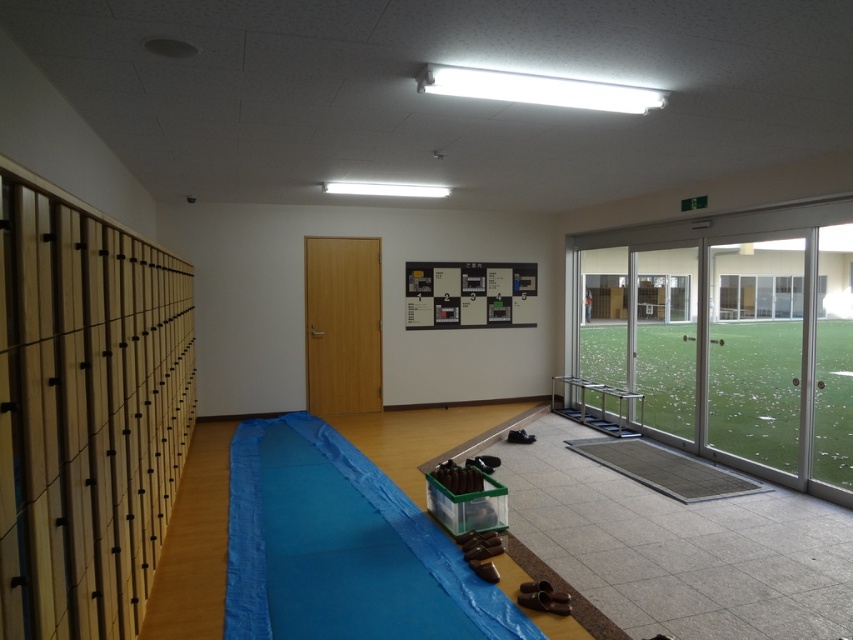
Is transparent glass door at right below blue fabric mat at center?

No.

Between point (653, 262) and point (416, 557), which one is positioned in front?

Point (416, 557)

At what (x,y) coordinates should I click in order to perform the action: click on transparent glass door at right. Please return your answer as a coordinate pair (x, y). Looking at the image, I should click on (727, 339).